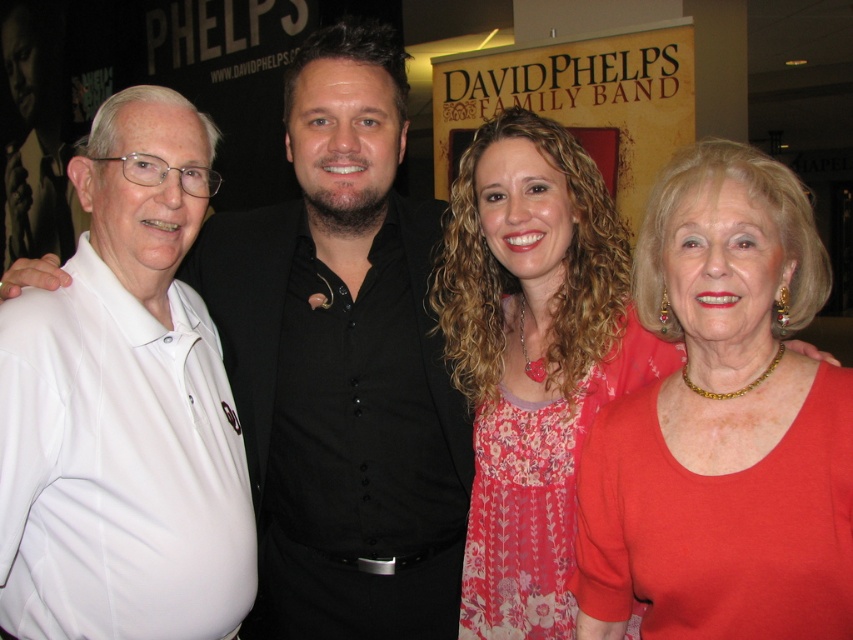
You are trying to determine which of the two white shirts in the image is wider. The white matte shirt at left and the white cotton polo shirt at left are both visible. Based on the scene, which one appears to be wider?

The white matte shirt at left is wider than the white cotton polo shirt at left according to the description.

You are a photographer who wants to ensure that the matte gold necklace at center and the floral dress at center are both visible in the final photo. Given their sizes, which one might require you to adjust your camera angle to capture more detail?

The matte gold necklace at center has a lesser height compared to the floral dress at center, so the necklace might need a closer camera angle to ensure its details are visible.

Based on the photo, which of the two white shirts, the white matte shirt at left or the white cotton polo shirt at left, is positioned more to the right?

The white matte shirt at left is positioned to the right of the white cotton polo shirt at left.